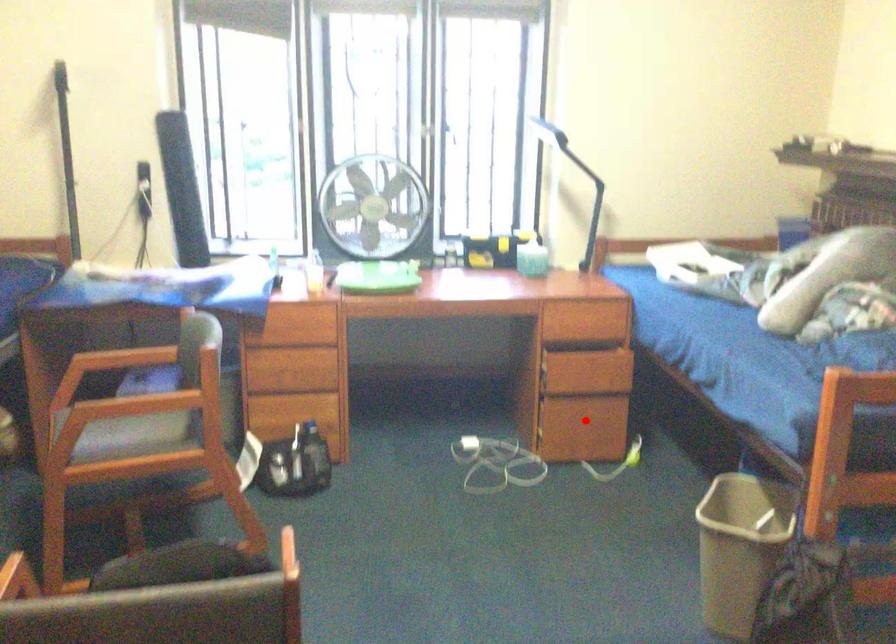
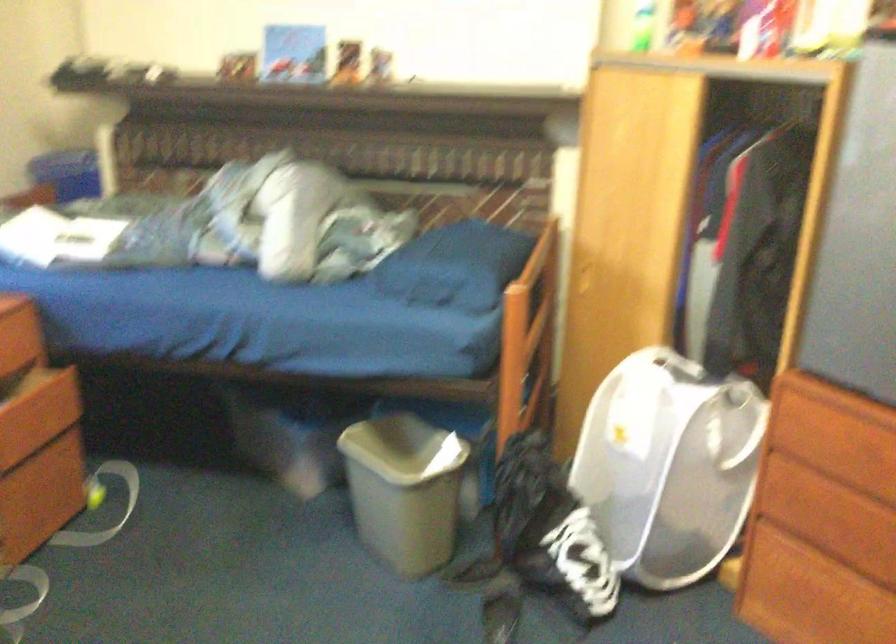
Question: I am providing you with two images of the same scene from different viewpoints. In image1, a red point is highlighted. Considering the same 3D point in image2, which of the following is correct?

Choices:
 (A) It is closer
 (B) It is farther

Answer: (A)